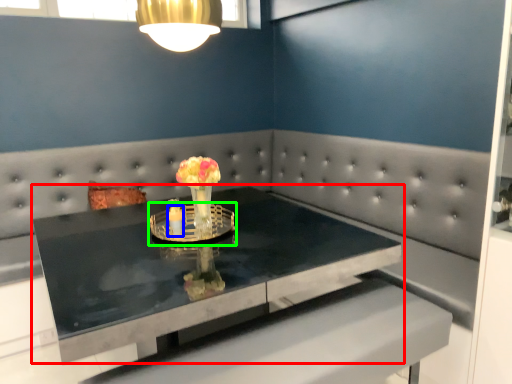
Question: Estimate the real-world distances between objects in this image. Which object is farther from table (highlighted by a red box), candle holder (highlighted by a blue box) or candle holder (highlighted by a green box)?

Choices:
 (A) candle holder
 (B) candle holder

Answer: (A)